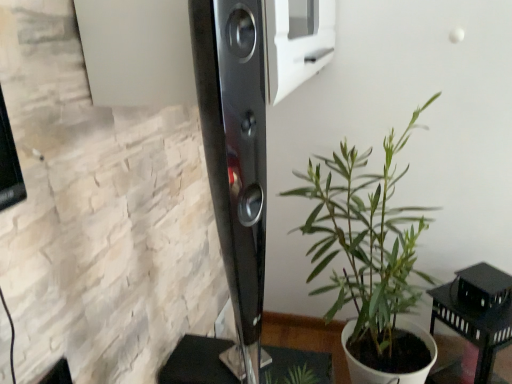
Question: Based on their sizes in the image, would you say black matte table at lower right is bigger or smaller than green leafy plant at center?

Choices:
 (A) small
 (B) big

Answer: (A)

Question: Considering their positions, is black matte table at lower right located in front of or behind green leafy plant at center?

Choices:
 (A) behind
 (B) front

Answer: (A)

Question: From a real-world perspective, is black matte table at lower right positioned above or below green leafy plant at center?

Choices:
 (A) above
 (B) below

Answer: (B)

Question: In the image, is green leafy plant at center positioned in front of or behind black matte table at lower right?

Choices:
 (A) behind
 (B) front

Answer: (B)

Question: Do you think green leafy plant at center is within black matte table at lower right, or outside of it?

Choices:
 (A) outside
 (B) inside

Answer: (A)

Question: Visually, is green leafy plant at center positioned to the left or to the right of black matte table at lower right?

Choices:
 (A) right
 (B) left

Answer: (B)

Question: Is green leafy plant at center bigger or smaller than black matte table at lower right?

Choices:
 (A) small
 (B) big

Answer: (B)